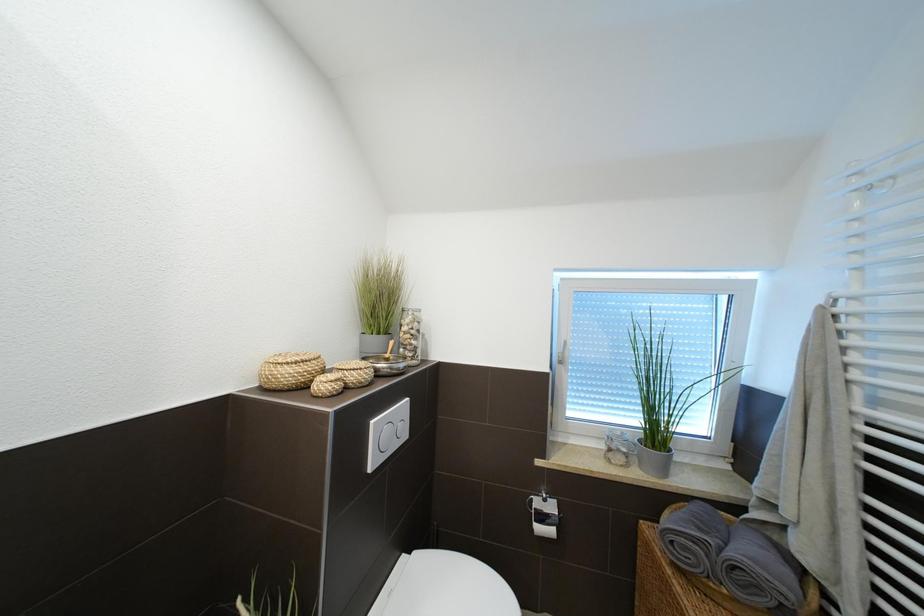
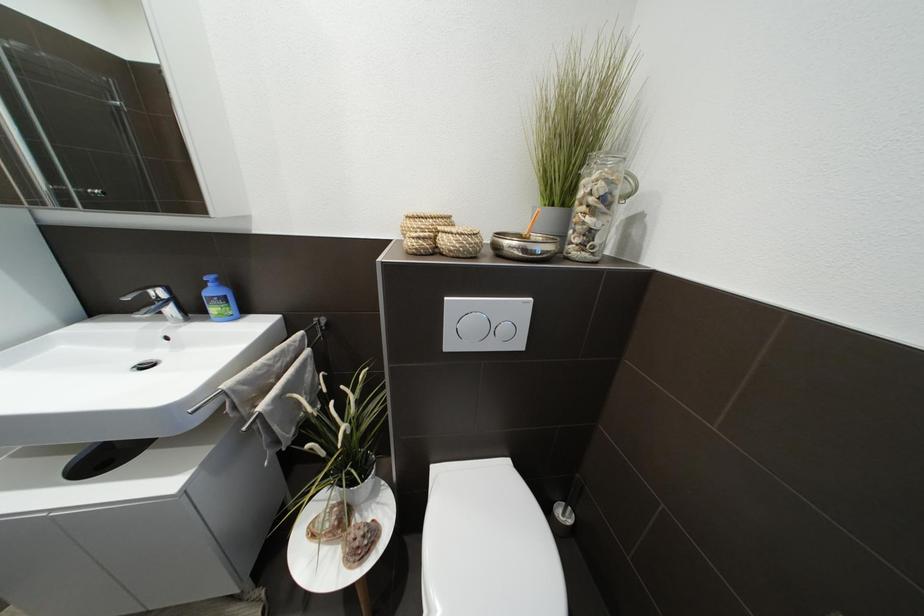
The first image is from the beginning of the video and the second image is from the end. How did the camera likely rotate when shooting the video?

The camera rotated toward left-down.